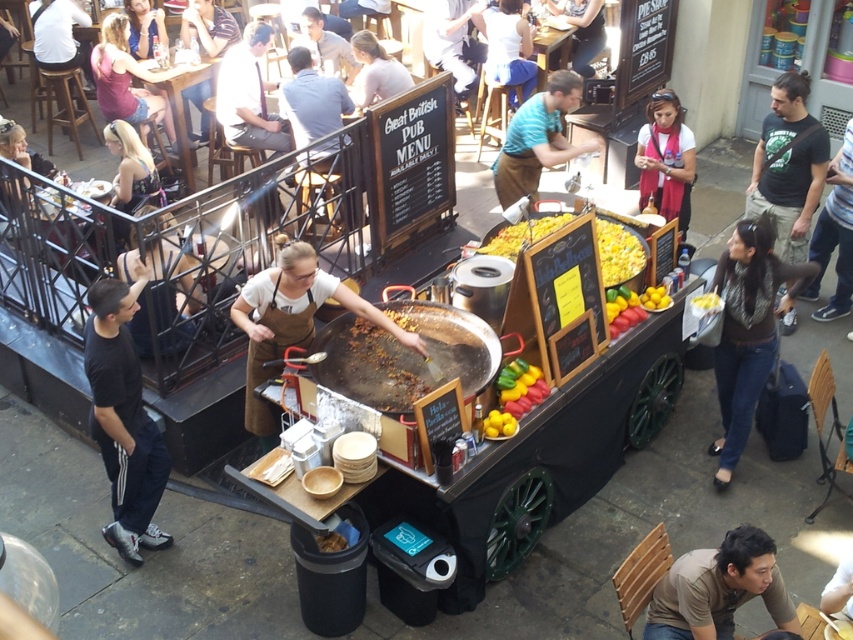
Based on the photo, you are standing in front of the mobile food cart and want to reach both the point at location (654, 188) and the point at (694, 314). Which point will you need to reach first if you move towards them from your current position?

You will need to reach point (654, 188) first because it is closer to you than point (694, 314), which is further away.